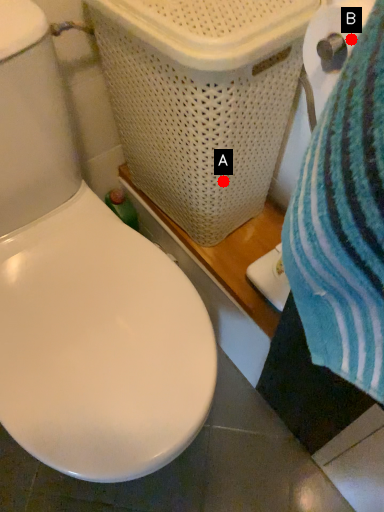
Question: Two points are circled on the image, labeled by A and B beside each circle. Which point is farther from the camera taking this photo?

Choices:
 (A) A is further
 (B) B is further

Answer: (A)